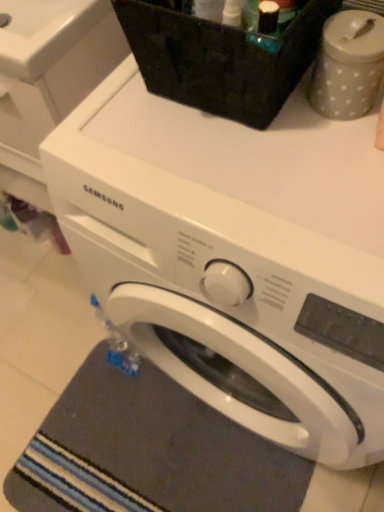
Where is `blank space situated above dark gray textured bath mat at lower left (from a real-world perspective)`? This screenshot has height=512, width=384. blank space situated above dark gray textured bath mat at lower left (from a real-world perspective) is located at coordinates [149, 450].